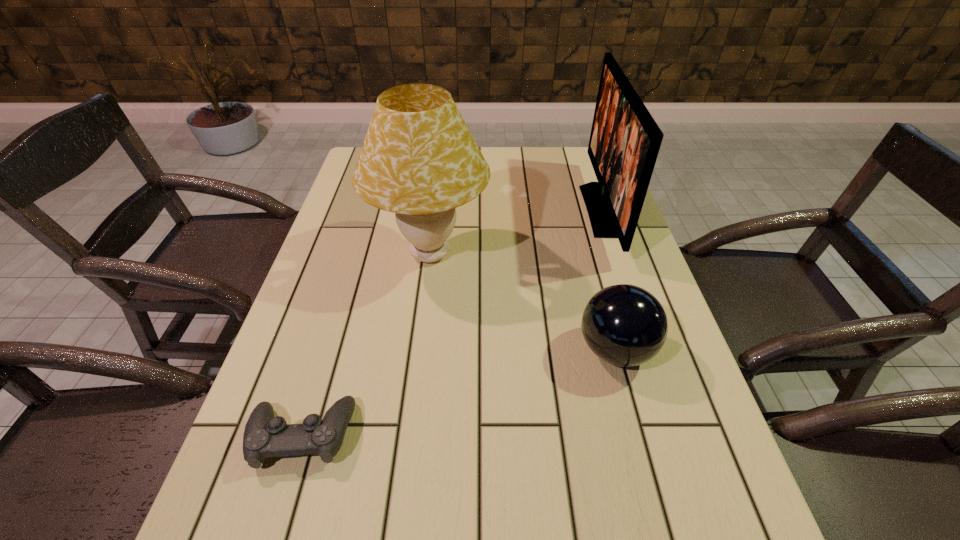
Locate an element on the screen. The image size is (960, 540). free point between the monitor and the lampshade is located at coordinates (516, 232).

This screenshot has height=540, width=960. Find the location of `unoccupied area between the nearest object and the monitor`. unoccupied area between the nearest object and the monitor is located at coordinates (452, 322).

Image resolution: width=960 pixels, height=540 pixels. Identify the location of vacant area between the third tallest object and the nearest object. (459, 393).

Where is `object that is the third nearest to the second nearest object`? This screenshot has height=540, width=960. object that is the third nearest to the second nearest object is located at coordinates (265, 436).

This screenshot has width=960, height=540. What are the coordinates of `the second closest object relative to the monitor` in the screenshot? It's located at (419, 160).